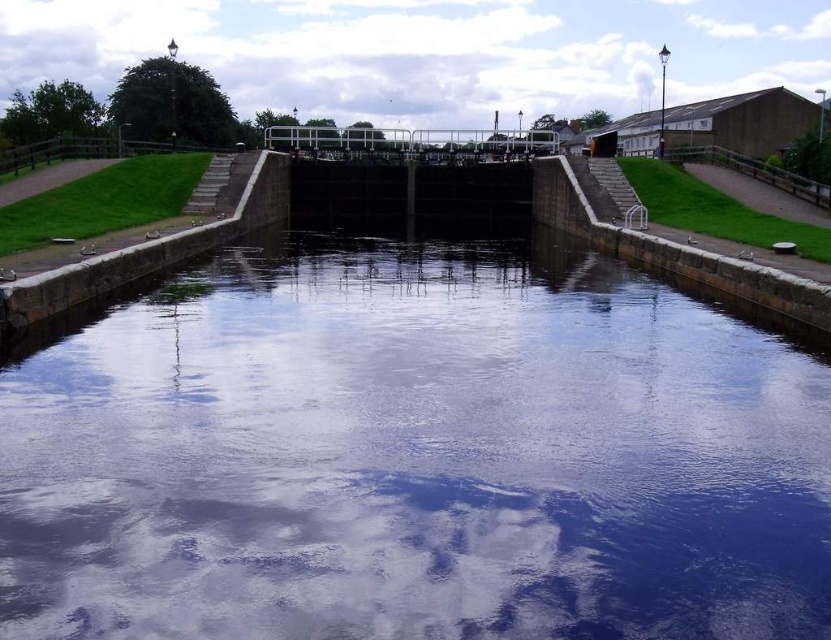
Question: Observing the image, what is the correct spatial positioning of transparent water at center in reference to white fluffy cloud at upper center?

Choices:
 (A) right
 (B) left

Answer: (B)

Question: Among these objects, which one is farthest from the camera?

Choices:
 (A) white fluffy cloud at upper center
 (B) transparent water at center

Answer: (A)

Question: Is transparent water at center positioned behind white fluffy cloud at upper center?

Choices:
 (A) no
 (B) yes

Answer: (A)

Question: Is transparent water at center wider than white fluffy cloud at upper center?

Choices:
 (A) yes
 (B) no

Answer: (B)

Question: Which of the following is the closest to the observer?

Choices:
 (A) (263, 454)
 (B) (322, 92)

Answer: (A)